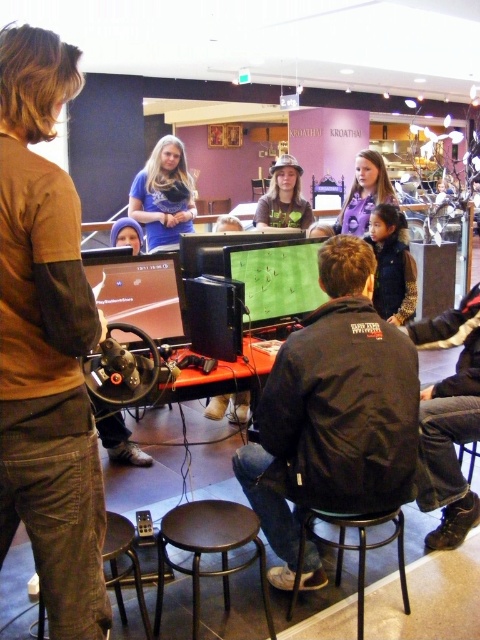
Question: Which point is closer to the camera?

Choices:
 (A) (146, 200)
 (B) (126, 225)

Answer: (B)

Question: Which point appears farthest from the camera in this image?

Choices:
 (A) (145, 634)
 (B) (117, 237)
 (C) (371, 154)
 (D) (369, 269)

Answer: (C)

Question: Can you confirm if dark brown wood stool at lower center is positioned above matte black jacket at center?

Choices:
 (A) yes
 (B) no

Answer: (B)

Question: Does dark blue denim vest at center have a greater width compared to dark gray t-shirt at center?

Choices:
 (A) no
 (B) yes

Answer: (A)

Question: Which object appears farthest from the camera in this image?

Choices:
 (A) brown leather stool at lower center
 (B) smooth brown leather jacket at center
 (C) blue fabric hat at center

Answer: (B)

Question: Can you confirm if dark brown wood stool at lower center is positioned below dark gray t-shirt at center?

Choices:
 (A) no
 (B) yes

Answer: (B)